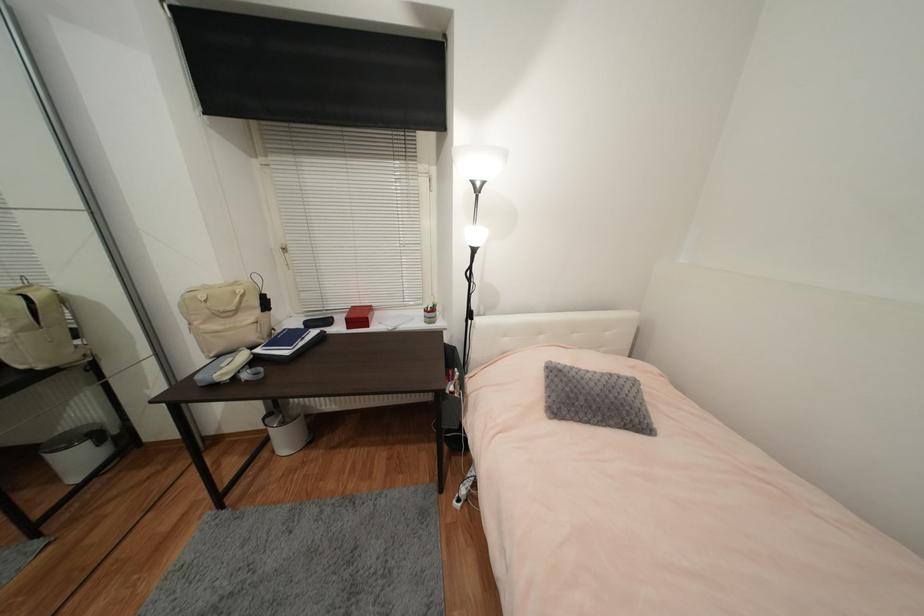
Where would you grasp the backpack handle? Please return your answer as a coordinate pair (x, y).

(25, 283)